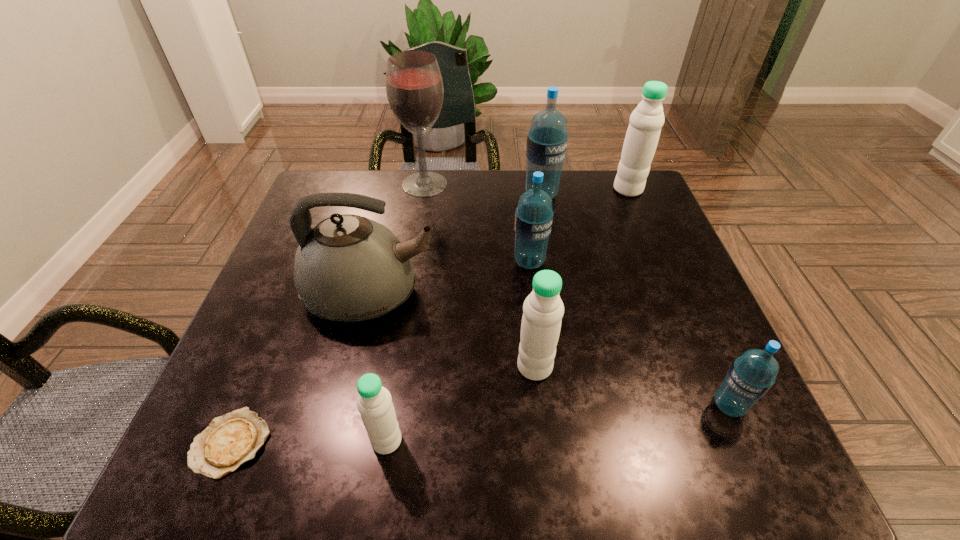
Find the location of a particular element. The height and width of the screenshot is (540, 960). vacant space that's between the kettle and the biggest blue water bottle is located at coordinates (456, 245).

Where is `free space between the second biggest white water bottle and the red alcohol`? free space between the second biggest white water bottle and the red alcohol is located at coordinates (480, 275).

The width and height of the screenshot is (960, 540). Find the location of `free space between the smallest white water bottle and the biggest white water bottle`. free space between the smallest white water bottle and the biggest white water bottle is located at coordinates (507, 315).

The width and height of the screenshot is (960, 540). In order to click on free space between the third farthest water bottle and the alcohol in this screenshot , I will do `click(477, 223)`.

You are a GUI agent. You are given a task and a screenshot of the screen. Output one action in this format:
    pyautogui.click(x=<x>, y=<y>)
    Task: Click on the free space between the kettle and the biggest blue water bottle
    
    Given the screenshot: What is the action you would take?
    pyautogui.click(x=456, y=245)

The width and height of the screenshot is (960, 540). I want to click on free space between the biggest white water bottle and the third farthest water bottle, so [579, 225].

The width and height of the screenshot is (960, 540). I want to click on object that is the closest to the biggest white water bottle, so click(x=547, y=139).

Where is `object that is the second closest to the second smallest white water bottle`? The width and height of the screenshot is (960, 540). object that is the second closest to the second smallest white water bottle is located at coordinates (533, 217).

This screenshot has width=960, height=540. Identify the location of water bottle that is the third closest to the brown quiche. (533, 217).

Identify the location of the second closest water bottle to the brown quiche. click(543, 309).